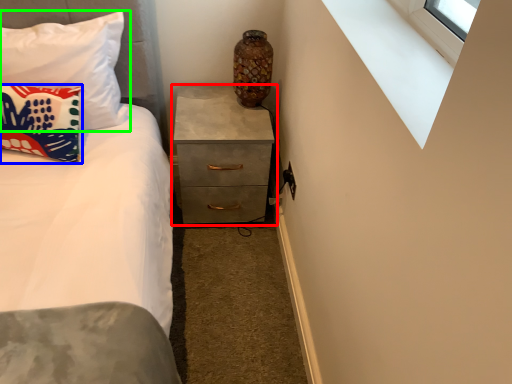
Question: Which object is positioned farthest from chest of drawers (highlighted by a red box)? Select from pillow (highlighted by a blue box) and pillow (highlighted by a green box).

Choices:
 (A) pillow
 (B) pillow

Answer: (A)